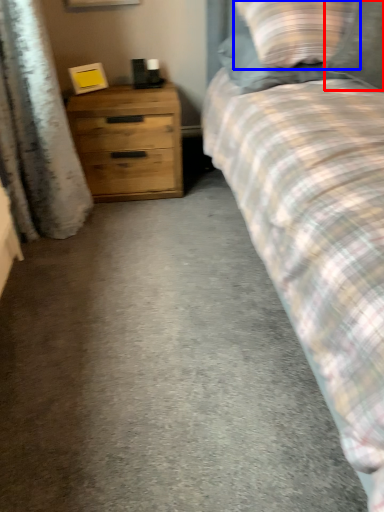
Question: Among these objects, which one is nearest to the camera, pillow (highlighted by a red box) or pillow (highlighted by a blue box)?

Choices:
 (A) pillow
 (B) pillow

Answer: (A)